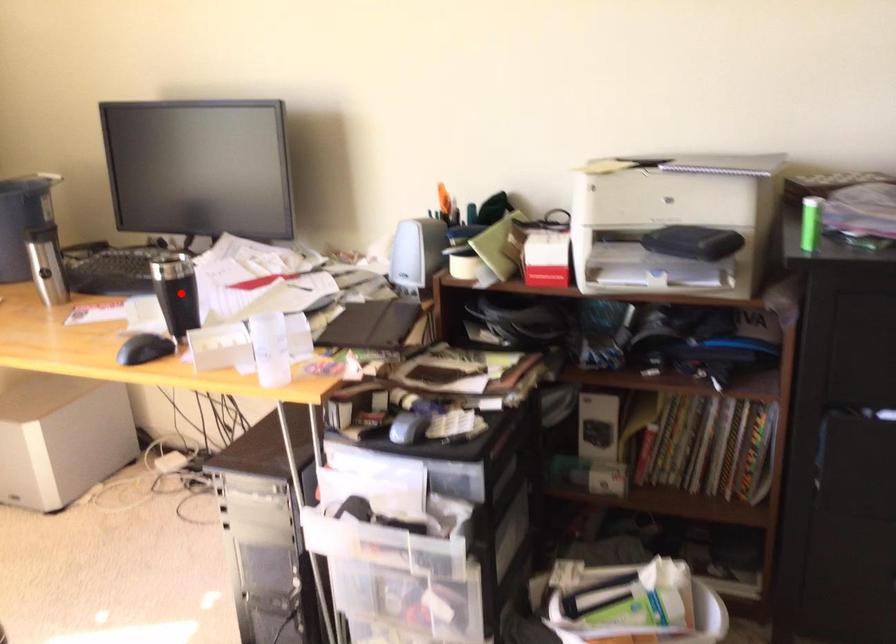
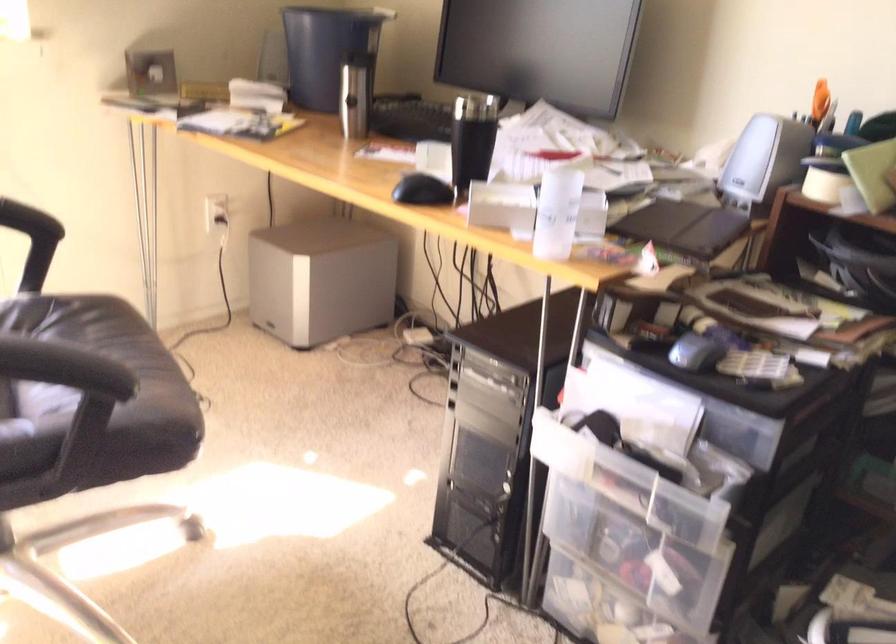
Locate, in the second image, the point that corresponds to the highlighted location in the first image.

(471, 140)